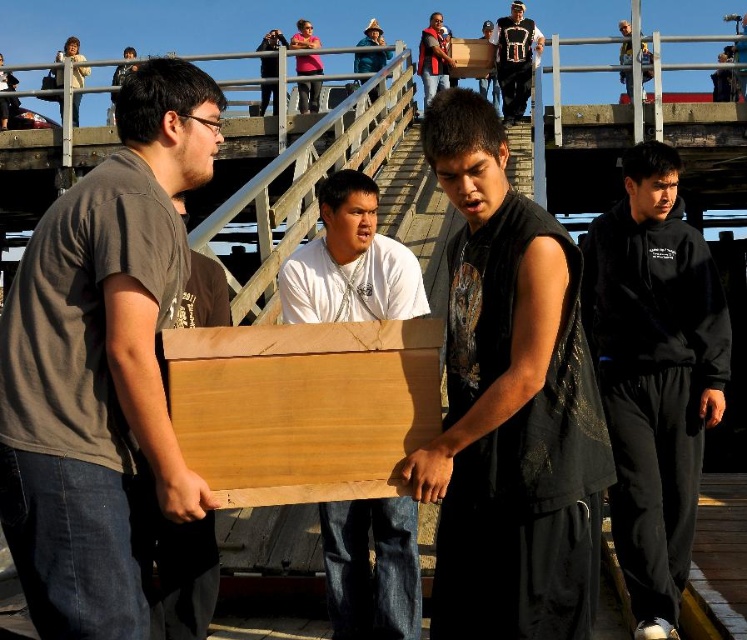
Which of these two, matte brown wood box at left or wooden board at center, stands taller?

Standing taller between the two is matte brown wood box at left.

Does matte brown wood box at left have a larger size compared to wooden board at center?

Correct, matte brown wood box at left is larger in size than wooden board at center.

This screenshot has height=640, width=747. In order to click on matte brown wood box at left in this screenshot , I will do click(x=108, y=378).

Which of these two, matte brown wood box at left or light brown wood board at center, stands taller?

light brown wood board at center is taller.

Is matte brown wood box at left positioned behind light brown wood board at center?

That is False.

At what (x,y) coordinates should I click in order to perform the action: click on matte brown wood box at left. Please return your answer as a coordinate pair (x, y). Looking at the image, I should click on (108, 378).

Which of these two, matte brown wood box at left or matte black vest at upper center, stands shorter?

With less height is matte black vest at upper center.

Which is in front, point (37, 376) or point (500, 100)?

Positioned in front is point (37, 376).

The image size is (747, 640). Find the location of `matte brown wood box at left`. matte brown wood box at left is located at coordinates (108, 378).